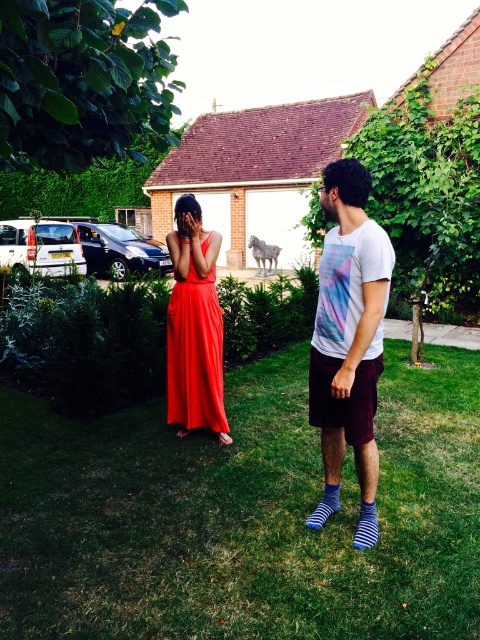
You are planning to place a small garden statue exactly between the green grass at center and the shiny satin dress at center. Based on their positions, which object should the statue be closer to?

The green grass at center is positioned on the right side of the shiny satin dress at center, so the statue should be closer to the shiny satin dress at center.